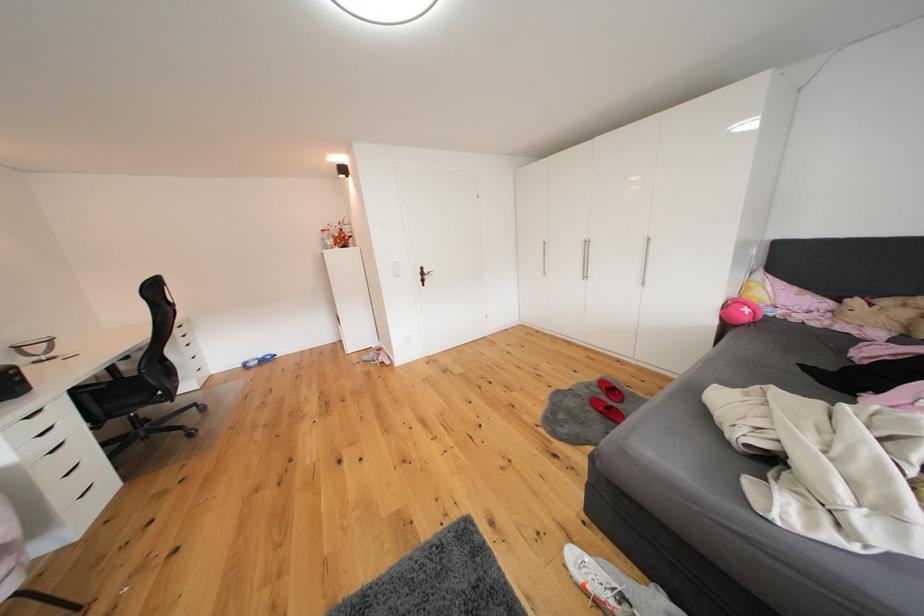
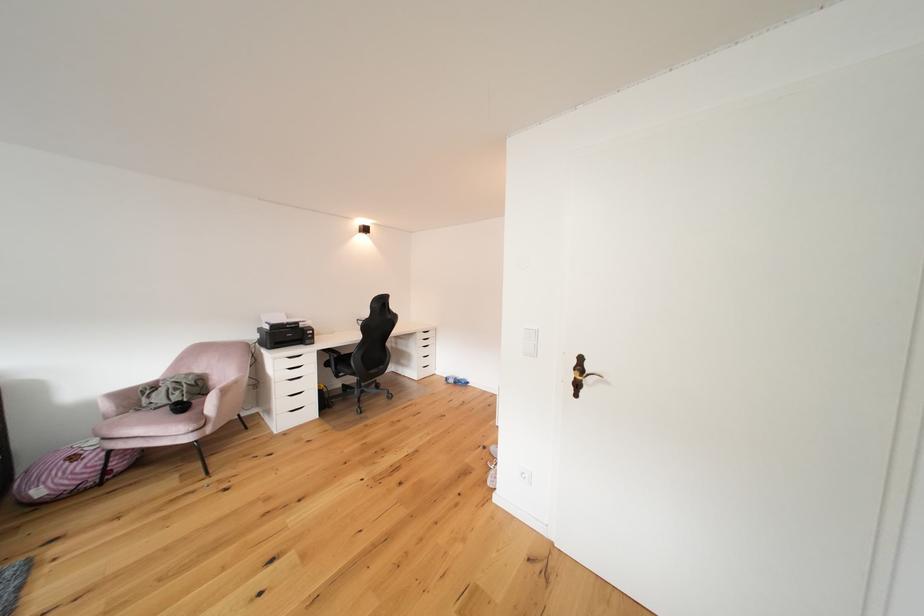
Locate, in the second image, the point that corresponds to (x=254, y=369) in the first image.

(456, 383)